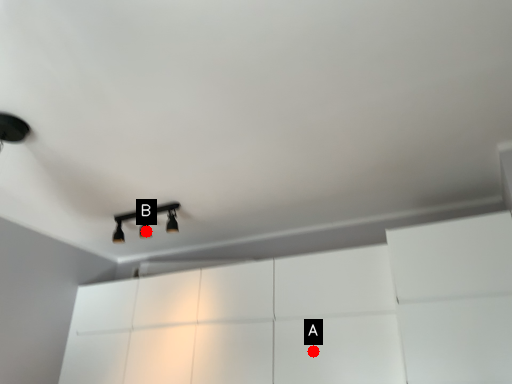
Question: Two points are circled on the image, labeled by A and B beside each circle. Which point is further to the camera?

Choices:
 (A) A is further
 (B) B is further

Answer: (B)